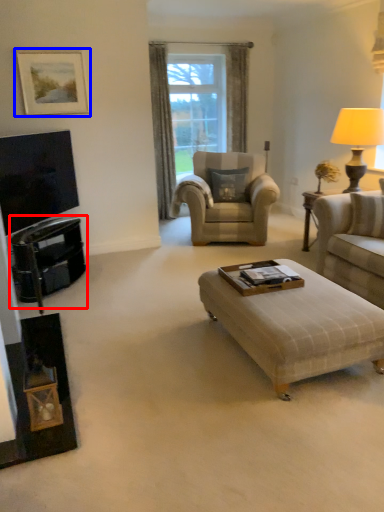
Question: Which object is closer to the camera taking this photo, dresser (highlighted by a red box) or picture frame (highlighted by a blue box)?

Choices:
 (A) dresser
 (B) picture frame

Answer: (A)